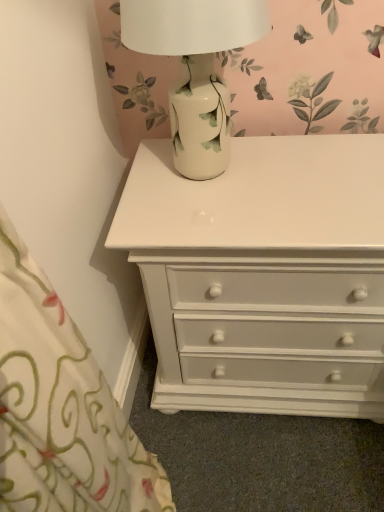
Where is `free location above white glossy chest of drawers at center (from a real-world perspective)`? This screenshot has height=512, width=384. free location above white glossy chest of drawers at center (from a real-world perspective) is located at coordinates (272, 179).